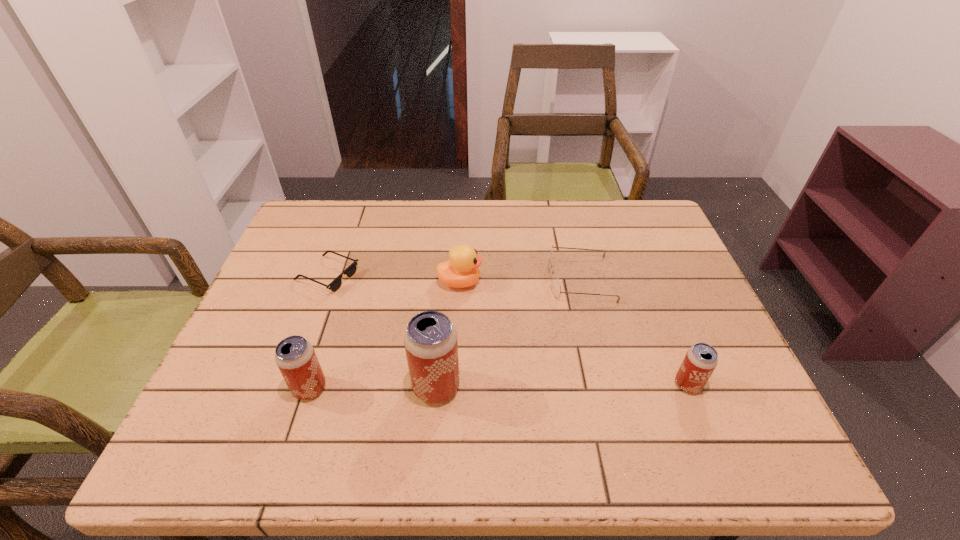
Find the location of `vacant area situated 0.360m on the back of the leftmost beer can`. vacant area situated 0.360m on the back of the leftmost beer can is located at coordinates (349, 265).

Find the location of `vacant position located on the back of the second beer can from right to left`. vacant position located on the back of the second beer can from right to left is located at coordinates (444, 286).

Find the location of a particular element. This screenshot has width=960, height=540. free location located on the left of the rightmost beer can is located at coordinates (506, 384).

I want to click on vacant area situated 0.330m on the lenses of the shortest object, so click(481, 276).

Where is `free space located on the front-facing side of the second object from right to left`? free space located on the front-facing side of the second object from right to left is located at coordinates (448, 279).

Find the location of a particular element. vacant space located on the front-facing side of the second object from right to left is located at coordinates (x=441, y=279).

In order to click on vacant space located 0.180m on the front-facing side of the second object from right to left in this screenshot , I will do `click(482, 279)`.

Identify the location of free space located on the face of the duckling. click(x=505, y=282).

At what (x,y) coordinates should I click in order to perform the action: click on object present at the left edge. Please return your answer as a coordinate pair (x, y). The width and height of the screenshot is (960, 540). Looking at the image, I should click on (335, 285).

The height and width of the screenshot is (540, 960). Identify the location of object located in the right edge section of the desktop. (701, 359).